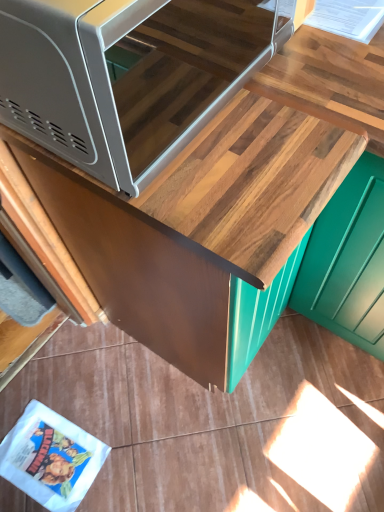
Locate an element on the screen. The height and width of the screenshot is (512, 384). free space to the left of wooden cabinet at upper center is located at coordinates (91, 384).